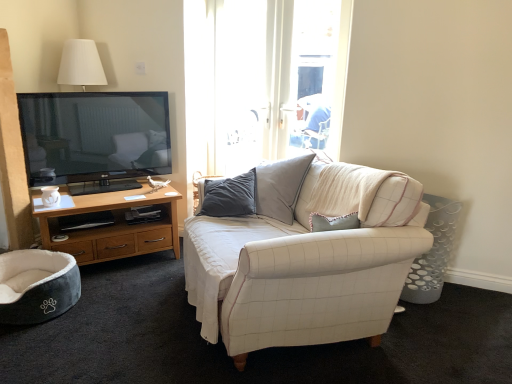
What is the approximate height of white fabric couch at center?

white fabric couch at center is 34.47 inches tall.

Identify the location of matte white coffee cup at left. (50, 196).

Where is `wooden cabinet at left`? wooden cabinet at left is located at coordinates (111, 226).

In order to click on cabinetry in front of the matte white coffee cup at left in this screenshot , I will do `click(111, 226)`.

How different are the orientations of matte white coffee cup at left and wooden cabinet at left in degrees?

0.941 degrees separate the facing orientations of matte white coffee cup at left and wooden cabinet at left.

Who is taller, matte white coffee cup at left or wooden cabinet at left?

wooden cabinet at left.

Between matte white coffee cup at left and wooden cabinet at left, which one appears on the right side from the viewer's perspective?

From the viewer's perspective, wooden cabinet at left appears more on the right side.

Which of these two, gray plush pet bed at lower left or wooden cabinet at left, stands shorter?

gray plush pet bed at lower left.

Find the location of a particular element. This screenshot has width=512, height=384. chair in front of the wooden cabinet at left is located at coordinates (37, 285).

Between gray plush pet bed at lower left and wooden cabinet at left, which one has smaller size?

With smaller size is gray plush pet bed at lower left.

From the image's perspective, is gray plush pet bed at lower left positioned above or below wooden cabinet at left?

gray plush pet bed at lower left is below wooden cabinet at left.

From the image's perspective, does white fabric couch at center appear higher than matte white coffee cup at left?

No.

Is white fabric couch at center turned away from matte white coffee cup at left?

No, white fabric couch at center's orientation is not away from matte white coffee cup at left.

Can you confirm if white fabric couch at center is smaller than matte white coffee cup at left?

Incorrect, white fabric couch at center is not smaller in size than matte white coffee cup at left.

How distant is white fabric couch at center from matte white coffee cup at left?

5.17 feet.

Is wooden cabinet at left smaller than white fabric couch at center?

Yes, wooden cabinet at left is smaller than white fabric couch at center.

The width and height of the screenshot is (512, 384). Find the location of `cabinetry that is below the white fabric couch at center (from the image's perspective)`. cabinetry that is below the white fabric couch at center (from the image's perspective) is located at coordinates (111, 226).

Is wooden cabinet at left positioned with its back to white fabric couch at center?

wooden cabinet at left does not have its back to white fabric couch at center.

From a real-world perspective, is white fabric couch at center positioned under gray plush pet bed at lower left based on gravity?

No, from a real-world perspective, white fabric couch at center is not under gray plush pet bed at lower left.

Is white fabric couch at center to the right of gray plush pet bed at lower left from the viewer's perspective?

Correct, you'll find white fabric couch at center to the right of gray plush pet bed at lower left.

Is white fabric couch at center positioned beyond the bounds of gray plush pet bed at lower left?

Absolutely, white fabric couch at center is external to gray plush pet bed at lower left.

What's the angular difference between white fabric couch at center and gray plush pet bed at lower left's facing directions?

The facing directions of white fabric couch at center and gray plush pet bed at lower left are 136 degrees apart.

Is gray plush pet bed at lower left facing towards matte white coffee cup at left?

No, gray plush pet bed at lower left does not turn towards matte white coffee cup at left.

In the image, is gray plush pet bed at lower left positioned in front of or behind matte white coffee cup at left?

In the image, gray plush pet bed at lower left appears in front of matte white coffee cup at left.

Consider the image. Is gray plush pet bed at lower left wider than matte white coffee cup at left?

Yes.

From the image's perspective, would you say matte white coffee cup at left is positioned over white fabric couch at center?

Correct, matte white coffee cup at left appears higher than white fabric couch at center in the image.

Can you tell me how much matte white coffee cup at left and white fabric couch at center differ in facing direction?

matte white coffee cup at left and white fabric couch at center are facing 94.6 degrees away from each other.

From a real-world perspective, which object stands above the other?

In real-world perspective, matte white coffee cup at left is above.

Between matte white coffee cup at left and white fabric couch at center, which one has less height?

matte white coffee cup at left.

Find the location of `coffee cup on the left of wooden cabinet at left`. coffee cup on the left of wooden cabinet at left is located at coordinates (50, 196).

Find the location of a particular element. The image size is (512, 384). cabinetry that is on the right side of gray plush pet bed at lower left is located at coordinates (111, 226).

Which object lies further to the anchor point white fabric couch at center, wooden cabinet at left or gray plush pet bed at lower left?

gray plush pet bed at lower left lies further to white fabric couch at center than the other object.

From the image, which object appears to be farther from gray plush pet bed at lower left, matte white coffee cup at left or white fabric couch at center?

white fabric couch at center is further to gray plush pet bed at lower left.

Looking at the image, which one is located further to white fabric couch at center, gray plush pet bed at lower left or matte white coffee cup at left?

matte white coffee cup at left lies further to white fabric couch at center than the other object.

From the image, which object appears to be nearer to white fabric couch at center, matte white coffee cup at left or wooden cabinet at left?

wooden cabinet at left lies closer to white fabric couch at center than the other object.

Looking at the image, which one is located closer to matte white coffee cup at left, gray plush pet bed at lower left or white fabric couch at center?

gray plush pet bed at lower left is positioned closer to the anchor matte white coffee cup at left.

Estimate the real-world distances between objects in this image. Which object is closer to white fabric couch at center, matte white coffee cup at left or gray plush pet bed at lower left?

gray plush pet bed at lower left lies closer to white fabric couch at center than the other object.

Which object lies nearer to the anchor point matte white coffee cup at left, white fabric couch at center or gray plush pet bed at lower left?

gray plush pet bed at lower left.

Based on their spatial positions, is wooden cabinet at left or matte white coffee cup at left closer to gray plush pet bed at lower left?

wooden cabinet at left is positioned closer to the anchor gray plush pet bed at lower left.

Locate an element on the screen. cabinetry situated between gray plush pet bed at lower left and white fabric couch at center from left to right is located at coordinates (111, 226).

Locate an element on the screen. This screenshot has width=512, height=384. cabinetry between matte white coffee cup at left and white fabric couch at center from left to right is located at coordinates (111, 226).

The height and width of the screenshot is (384, 512). I want to click on cabinetry between gray plush pet bed at lower left and matte white coffee cup at left along the z-axis, so click(111, 226).

The width and height of the screenshot is (512, 384). What are the coordinates of `coffee cup between gray plush pet bed at lower left and white fabric couch at center` in the screenshot? It's located at (50, 196).